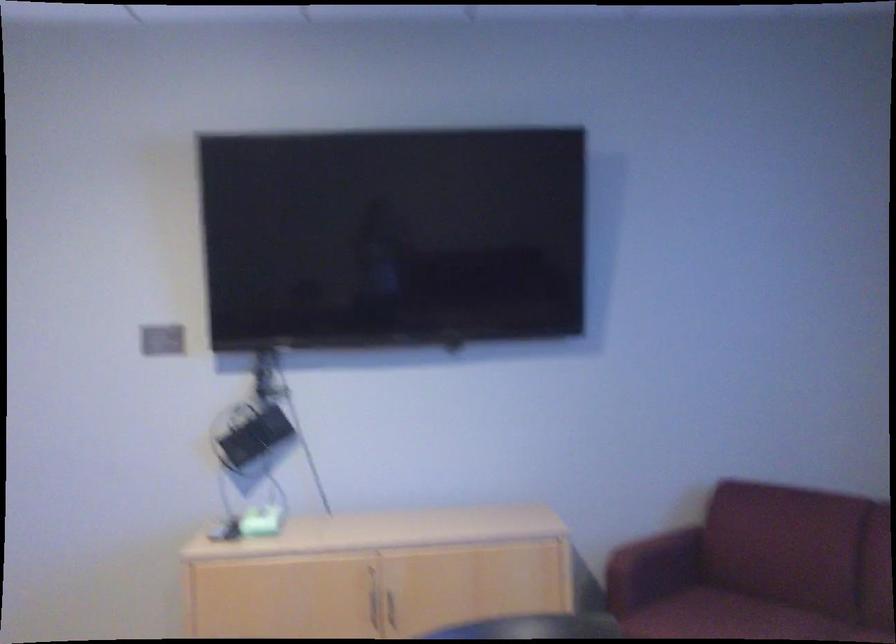
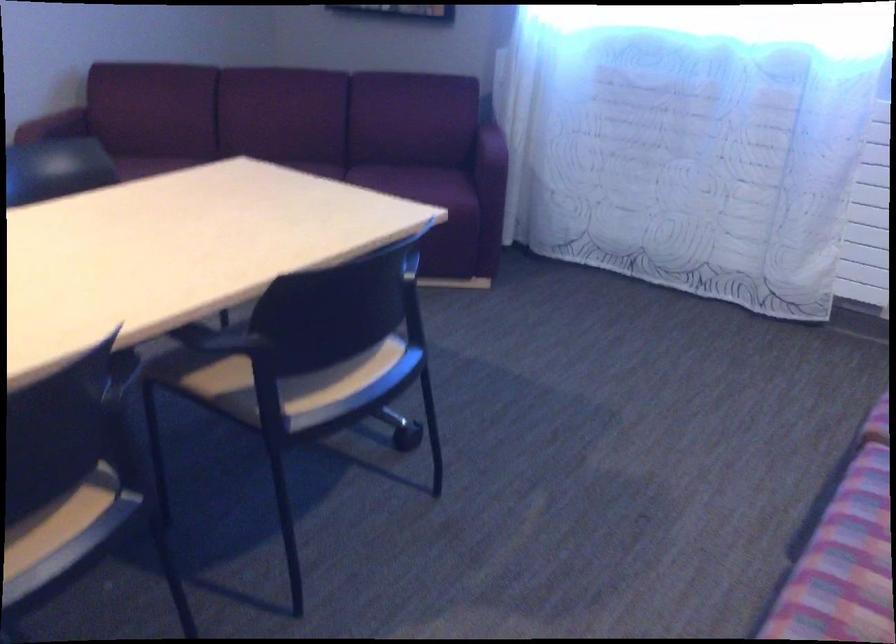
Find the pixel in the second image that matches point (659, 556) in the first image.

(54, 125)